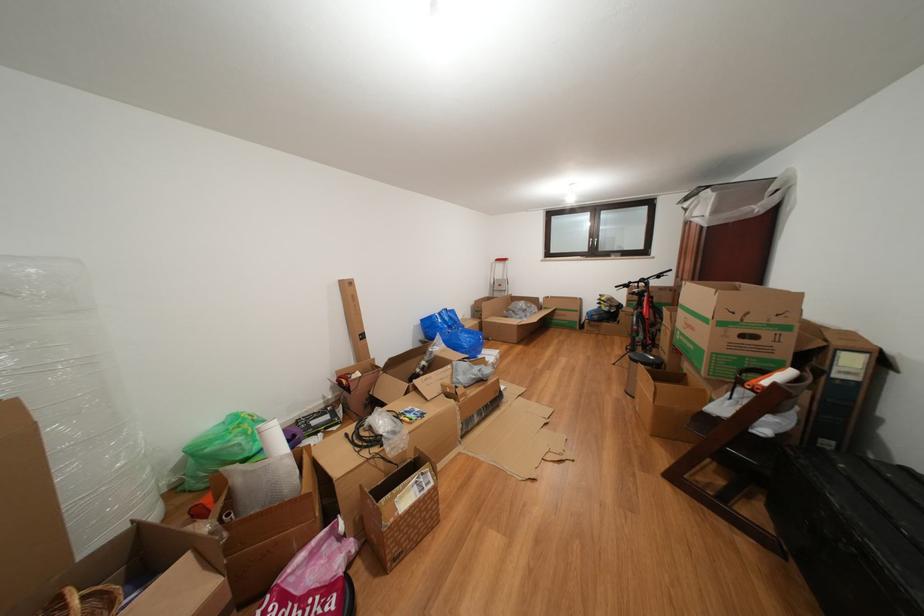
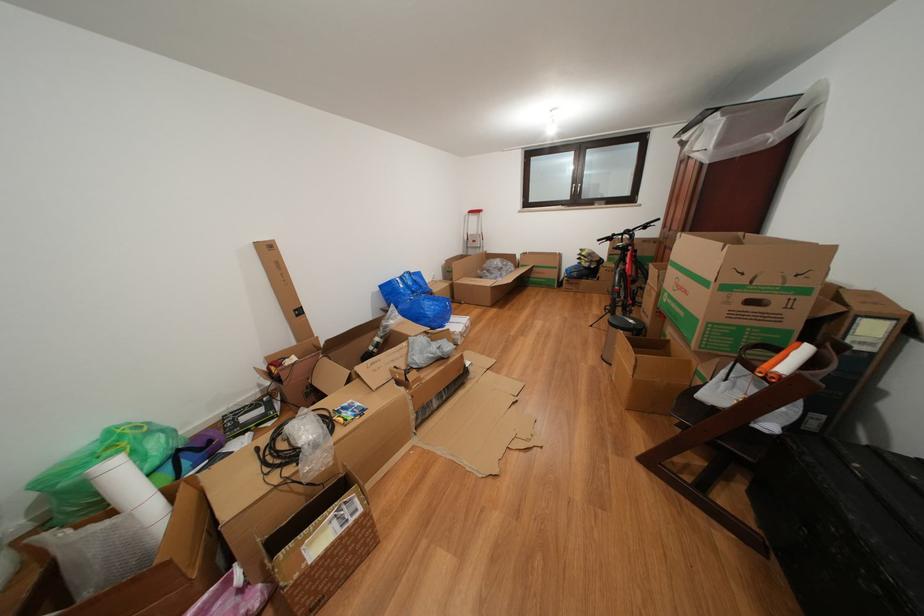
Where in the second image is the point corresponding to pixel 593 254 from the first image?

(576, 203)